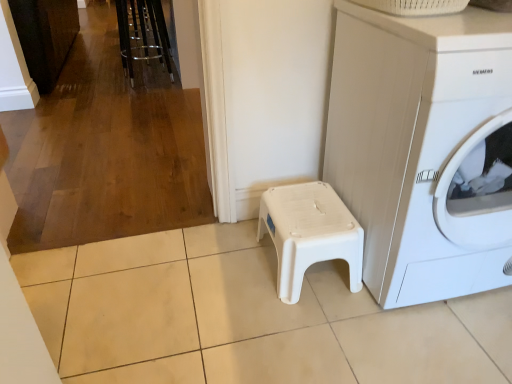
This screenshot has width=512, height=384. What are the coordinates of `vacant region above white plastic stool at center (from a real-world perspective)` in the screenshot? It's located at (306, 213).